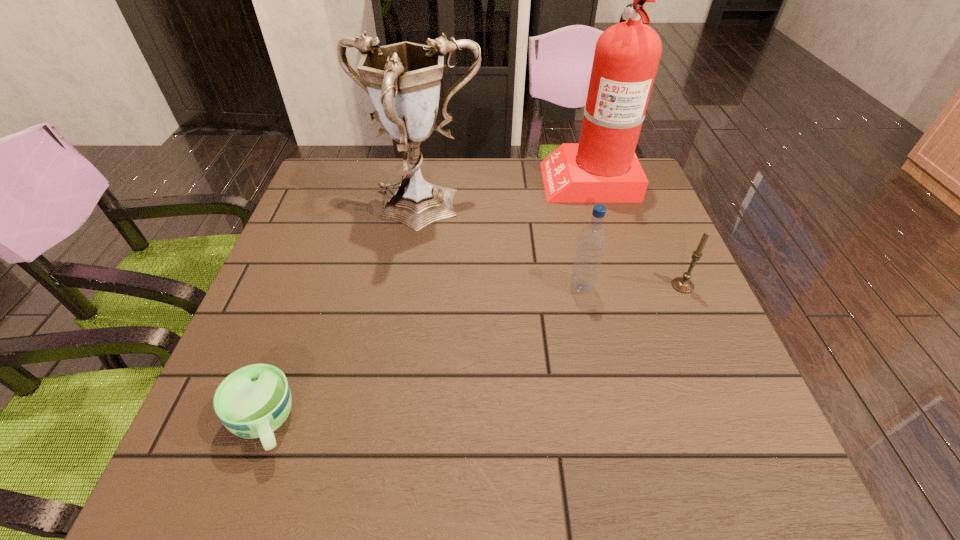
Where is `free space between the shortest object and the candle`? The width and height of the screenshot is (960, 540). free space between the shortest object and the candle is located at coordinates (473, 354).

The image size is (960, 540). Find the location of `free point between the second shortest object and the third tallest object`. free point between the second shortest object and the third tallest object is located at coordinates (632, 286).

Image resolution: width=960 pixels, height=540 pixels. I want to click on vacant area that lies between the second tallest object and the water bottle, so click(x=500, y=249).

Where is `vacant space that's between the second tallest object and the fire extinguisher`? The width and height of the screenshot is (960, 540). vacant space that's between the second tallest object and the fire extinguisher is located at coordinates (504, 195).

Identify the location of vacant area between the shortest object and the candle. (473, 354).

Where is `free space between the fourth shortest object and the water bottle`? The width and height of the screenshot is (960, 540). free space between the fourth shortest object and the water bottle is located at coordinates (500, 249).

Find the location of a particular element. vacant area that lies between the trophy cup and the cup is located at coordinates (342, 317).

Identify which object is the third nearest to the trophy cup. Please provide its 2D coordinates. Your answer should be formatted as a tuple, i.e. [(x, y)], where the tuple contains the x and y coordinates of a point satisfying the conditions above.

[(252, 402)]

Point out which object is positioned as the nearest to the fire extinguisher. Please provide its 2D coordinates. Your answer should be formatted as a tuple, i.e. [(x, y)], where the tuple contains the x and y coordinates of a point satisfying the conditions above.

[(403, 80)]

I want to click on free location that satisfies the following two spatial constraints: 1. on the front-facing side of the fire extinguisher; 2. on the front side of the cup, so click(x=660, y=423).